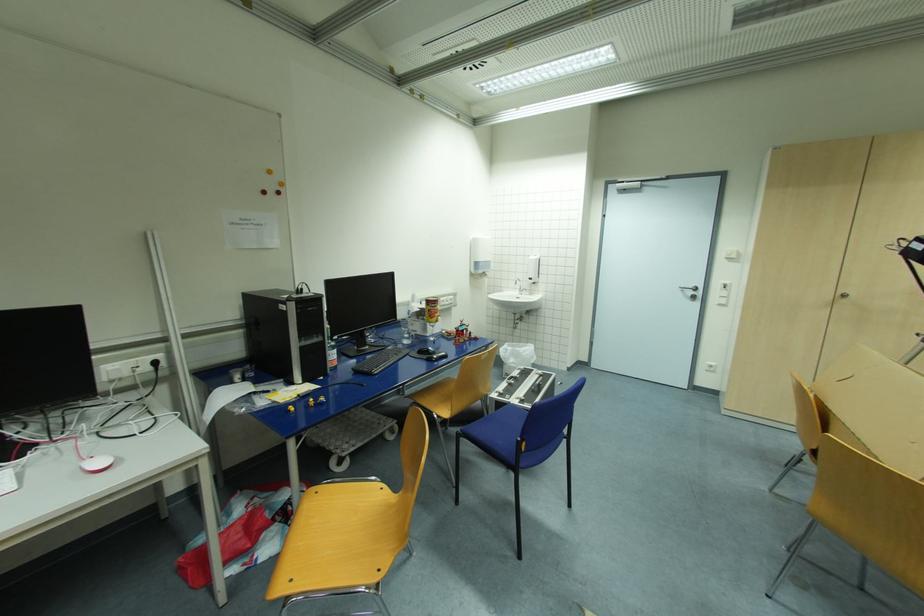
Image resolution: width=924 pixels, height=616 pixels. Identify the location of red computer mouse. (96, 464).